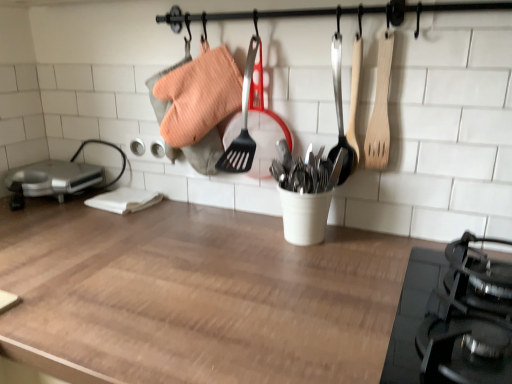
Question: Considering the relative sizes of metallic silver appliance at left and wooden at center in the image provided, is metallic silver appliance at left bigger than wooden at center?

Choices:
 (A) yes
 (B) no

Answer: (B)

Question: Can you confirm if metallic silver appliance at left is positioned to the right of wooden at center?

Choices:
 (A) no
 (B) yes

Answer: (A)

Question: Could wooden at center be considered to be inside metallic silver appliance at left?

Choices:
 (A) yes
 (B) no

Answer: (B)

Question: Can you confirm if metallic silver appliance at left is positioned to the left of wooden at center?

Choices:
 (A) yes
 (B) no

Answer: (A)

Question: Does metallic silver appliance at left have a greater height compared to wooden at center?

Choices:
 (A) yes
 (B) no

Answer: (B)

Question: Considering the relative sizes of metallic silver appliance at left and wooden at center in the image provided, is metallic silver appliance at left wider than wooden at center?

Choices:
 (A) yes
 (B) no

Answer: (B)

Question: Is wooden at center aimed at wooden spatula at upper right?

Choices:
 (A) no
 (B) yes

Answer: (A)

Question: From the image's perspective, is wooden at center located above wooden spatula at upper right?

Choices:
 (A) yes
 (B) no

Answer: (B)

Question: Considering the relative sizes of wooden at center and wooden spatula at upper right in the image provided, is wooden at center thinner than wooden spatula at upper right?

Choices:
 (A) no
 (B) yes

Answer: (A)

Question: Does wooden at center have a smaller size compared to wooden spatula at upper right?

Choices:
 (A) no
 (B) yes

Answer: (A)

Question: Is wooden at center outside of wooden spatula at upper right?

Choices:
 (A) yes
 (B) no

Answer: (A)

Question: Considering the relative sizes of wooden at center and wooden spatula at upper right in the image provided, is wooden at center wider than wooden spatula at upper right?

Choices:
 (A) no
 (B) yes

Answer: (B)

Question: Does metallic silver appliance at left have a greater height compared to wooden spatula at upper right?

Choices:
 (A) yes
 (B) no

Answer: (B)